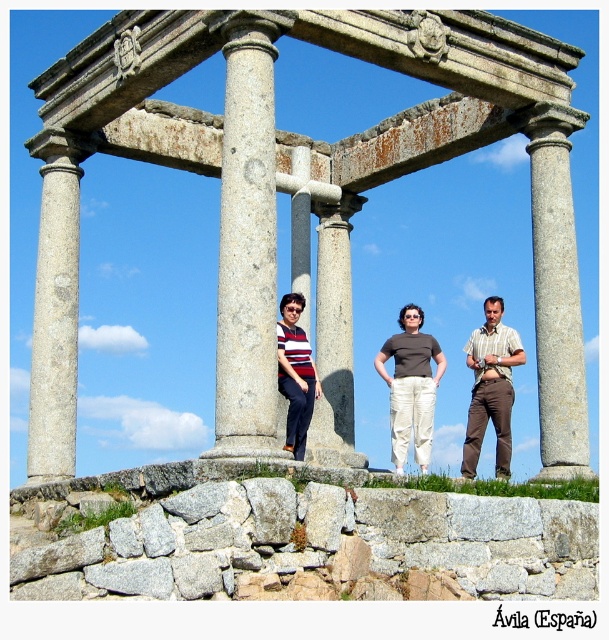
Question: Which of the following is the farthest from the observer?

Choices:
 (A) (343, 376)
 (B) (505, 449)
 (C) (289, 388)
 (D) (30, 476)

Answer: (A)

Question: Which object is positioned closest to the matte brown shirt at center?

Choices:
 (A) smooth gray column at center
 (B) gray stone column at right
 (C) striped shirt at center

Answer: (C)

Question: Can you confirm if matte brown pants at center is bigger than striped shirt at center?

Choices:
 (A) no
 (B) yes

Answer: (B)

Question: Can you confirm if gray stone ruins at center is wider than striped fabric shirt at center?

Choices:
 (A) no
 (B) yes

Answer: (B)

Question: Does gray stone ruins at center appear on the left side of matte brown shirt at center?

Choices:
 (A) yes
 (B) no

Answer: (A)

Question: Which object is farther from the camera taking this photo?

Choices:
 (A) gray stone column at left
 (B) striped shirt at center
 (C) matte brown shirt at center
 (D) matte brown pants at center

Answer: (B)